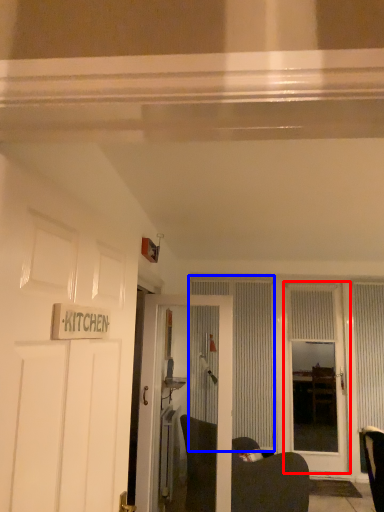
Question: Which point is further to the camera, door (highlighted by a red box) or curtain (highlighted by a blue box)?

Choices:
 (A) door
 (B) curtain

Answer: (B)